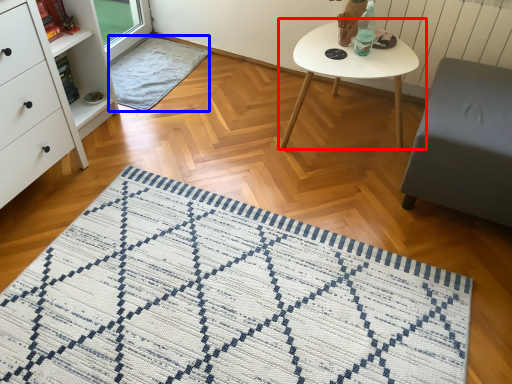
Question: Among these objects, which one is nearest to the camera, coffee table (highlighted by a red box) or blanket (highlighted by a blue box)?

Choices:
 (A) coffee table
 (B) blanket

Answer: (A)